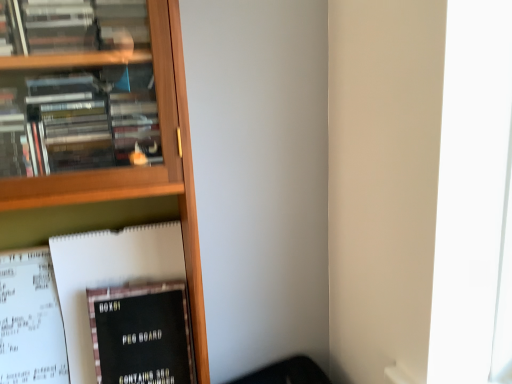
Image resolution: width=512 pixels, height=384 pixels. What do you see at coordinates (125, 305) in the screenshot?
I see `black matte peg board at lower left, which is counted as the 2th book, starting from the bottom` at bounding box center [125, 305].

Locate an element on the screen. Image resolution: width=512 pixels, height=384 pixels. black matte peg board at lower left, positioned as the 1th book in top-to-bottom order is located at coordinates (125, 305).

What do you see at coordinates (141, 334) in the screenshot?
I see `black matte peg board at lower left, acting as the 1th book starting from the bottom` at bounding box center [141, 334].

At what (x,y) coordinates should I click in order to perform the action: click on black matte peg board at lower left, which is counted as the second book, starting from the top. Please return your answer as a coordinate pair (x, y). The image size is (512, 384). Looking at the image, I should click on (141, 334).

The width and height of the screenshot is (512, 384). What are the coordinates of `black matte peg board at lower left, which is counted as the 2th book, starting from the bottom` in the screenshot? It's located at [x=125, y=305].

Is black matte peg board at lower left, which is counted as the second book, starting from the top, to the left or to the right of black matte peg board at lower left, which is counted as the 2th book, starting from the bottom, in the image?

In the image, black matte peg board at lower left, which is counted as the second book, starting from the top, appears on the right side of black matte peg board at lower left, which is counted as the 2th book, starting from the bottom.

Considering their positions, is black matte peg board at lower left, acting as the 1th book starting from the bottom, located in front of or behind black matte peg board at lower left, positioned as the 1th book in top-to-bottom order?

black matte peg board at lower left, acting as the 1th book starting from the bottom, is positioned closer to the viewer than black matte peg board at lower left, positioned as the 1th book in top-to-bottom order.

Which is further, (182, 369) or (139, 313)?

The point (182, 369) is behind.

From the image's perspective, which one is positioned lower, black matte peg board at lower left, which is counted as the second book, starting from the top, or black matte peg board at lower left, which is counted as the 2th book, starting from the bottom?

black matte peg board at lower left, which is counted as the second book, starting from the top, is shown below in the image.

From a real-world perspective, which object stands above the other?

black matte peg board at lower left, which is counted as the 2th book, starting from the bottom.

Can you confirm if black matte peg board at lower left, acting as the 1th book starting from the bottom, is thinner than black matte peg board at lower left, positioned as the 1th book in top-to-bottom order?

Indeed, black matte peg board at lower left, acting as the 1th book starting from the bottom, has a lesser width compared to black matte peg board at lower left, positioned as the 1th book in top-to-bottom order.

Between black matte peg board at lower left, acting as the 1th book starting from the bottom, and black matte peg board at lower left, which is counted as the 2th book, starting from the bottom, which one has more height?

With more height is black matte peg board at lower left, which is counted as the 2th book, starting from the bottom.

Is black matte peg board at lower left, acting as the 1th book starting from the bottom, smaller than black matte peg board at lower left, which is counted as the 2th book, starting from the bottom?

Yes.

Is black matte peg board at lower left, acting as the 1th book starting from the bottom, not inside black matte peg board at lower left, positioned as the 1th book in top-to-bottom order?

That's incorrect, black matte peg board at lower left, acting as the 1th book starting from the bottom, is not completely outside black matte peg board at lower left, positioned as the 1th book in top-to-bottom order.

In the scene shown: Is black matte peg board at lower left, which is counted as the second book, starting from the top, next to black matte peg board at lower left, positioned as the 1th book in top-to-bottom order?

Yes, black matte peg board at lower left, which is counted as the second book, starting from the top, is with black matte peg board at lower left, positioned as the 1th book in top-to-bottom order.

Is black matte peg board at lower left, acting as the 1th book starting from the bottom, oriented away from black matte peg board at lower left, which is counted as the 2th book, starting from the bottom?

Yes.

Identify the location of book behind the black matte peg board at lower left, acting as the 1th book starting from the bottom. (125, 305).

Based on the photo, is black matte peg board at lower left, positioned as the 1th book in top-to-bottom order, to the left or to the right of black matte peg board at lower left, acting as the 1th book starting from the bottom, in the image?

From the image, it's evident that black matte peg board at lower left, positioned as the 1th book in top-to-bottom order, is to the left of black matte peg board at lower left, acting as the 1th book starting from the bottom.

Relative to black matte peg board at lower left, acting as the 1th book starting from the bottom, is black matte peg board at lower left, which is counted as the 2th book, starting from the bottom, in front or behind?

black matte peg board at lower left, which is counted as the 2th book, starting from the bottom, is positioned farther from the viewer than black matte peg board at lower left, acting as the 1th book starting from the bottom.

Between point (132, 284) and point (119, 328), which one is positioned behind?

The point (132, 284) is farther.

From the image's perspective, is black matte peg board at lower left, which is counted as the 2th book, starting from the bottom, above black matte peg board at lower left, which is counted as the second book, starting from the top?

Yes.

From a real-world perspective, is black matte peg board at lower left, which is counted as the 2th book, starting from the bottom, physically below black matte peg board at lower left, which is counted as the second book, starting from the top?

No.

Considering the sizes of objects black matte peg board at lower left, positioned as the 1th book in top-to-bottom order, and black matte peg board at lower left, acting as the 1th book starting from the bottom, in the image provided, who is thinner, black matte peg board at lower left, positioned as the 1th book in top-to-bottom order, or black matte peg board at lower left, acting as the 1th book starting from the bottom,?

black matte peg board at lower left, acting as the 1th book starting from the bottom, is thinner.

Does black matte peg board at lower left, which is counted as the 2th book, starting from the bottom, have a greater height compared to black matte peg board at lower left, acting as the 1th book starting from the bottom?

Yes.

Who is bigger, black matte peg board at lower left, which is counted as the 2th book, starting from the bottom, or black matte peg board at lower left, acting as the 1th book starting from the bottom?

black matte peg board at lower left, which is counted as the 2th book, starting from the bottom.

Is black matte peg board at lower left, positioned as the 1th book in top-to-bottom order, surrounding black matte peg board at lower left, acting as the 1th book starting from the bottom?

Yes.

Is black matte peg board at lower left, positioned as the 1th book in top-to-bottom order, touching black matte peg board at lower left, acting as the 1th book starting from the bottom?

Yes, black matte peg board at lower left, positioned as the 1th book in top-to-bottom order, is beside black matte peg board at lower left, acting as the 1th book starting from the bottom.

Is black matte peg board at lower left, which is counted as the 2th book, starting from the bottom, turned away from black matte peg board at lower left, acting as the 1th book starting from the bottom?

Yes, black matte peg board at lower left, acting as the 1th book starting from the bottom, is at the back of black matte peg board at lower left, which is counted as the 2th book, starting from the bottom.

How distant is black matte peg board at lower left, which is counted as the 2th book, starting from the bottom, from black matte peg board at lower left, which is counted as the second book, starting from the top?

black matte peg board at lower left, which is counted as the 2th book, starting from the bottom, and black matte peg board at lower left, which is counted as the second book, starting from the top, are 3.06 centimeters apart from each other.

You are a GUI agent. You are given a task and a screenshot of the screen. Output one action in this format:
    pyautogui.click(x=<x>, y=<y>)
    Task: Click on the book that appears on the left of black matte peg board at lower left, which is counted as the second book, starting from the top
    
    Given the screenshot: What is the action you would take?
    pyautogui.click(x=125, y=305)

I want to click on book above the black matte peg board at lower left, acting as the 1th book starting from the bottom (from the image's perspective), so click(125, 305).

The image size is (512, 384). Identify the location of book located below the black matte peg board at lower left, positioned as the 1th book in top-to-bottom order (from the image's perspective). pos(141,334).